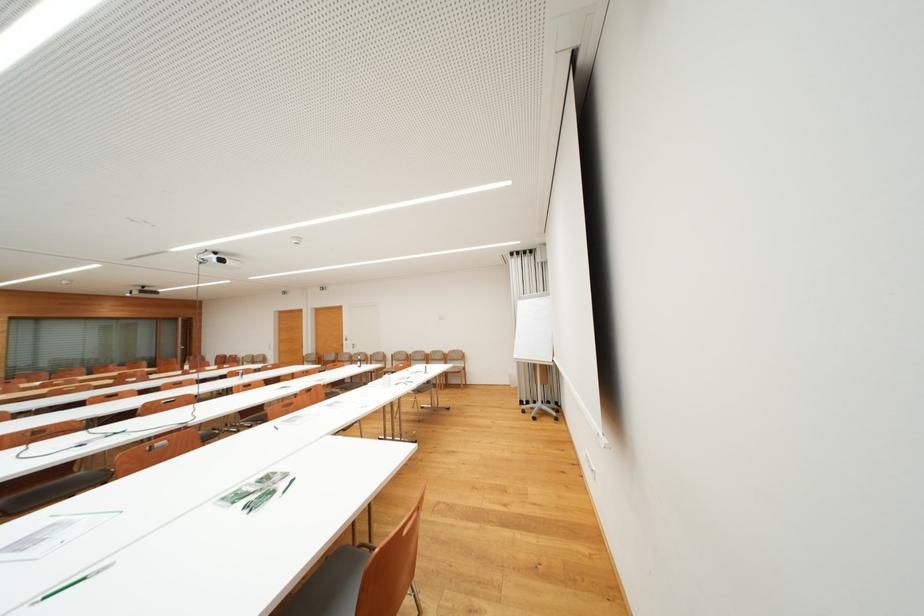
Find where to sit the orange chair sitting surface. Please return your answer as a coordinate pair (x, y).

(339, 581)